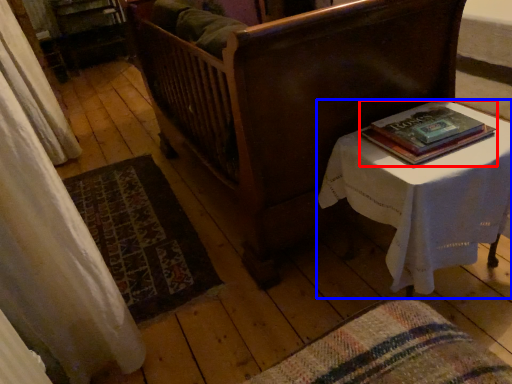
Question: Among these objects, which one is farthest to the camera, book (highlighted by a red box) or table (highlighted by a blue box)?

Choices:
 (A) book
 (B) table

Answer: (A)